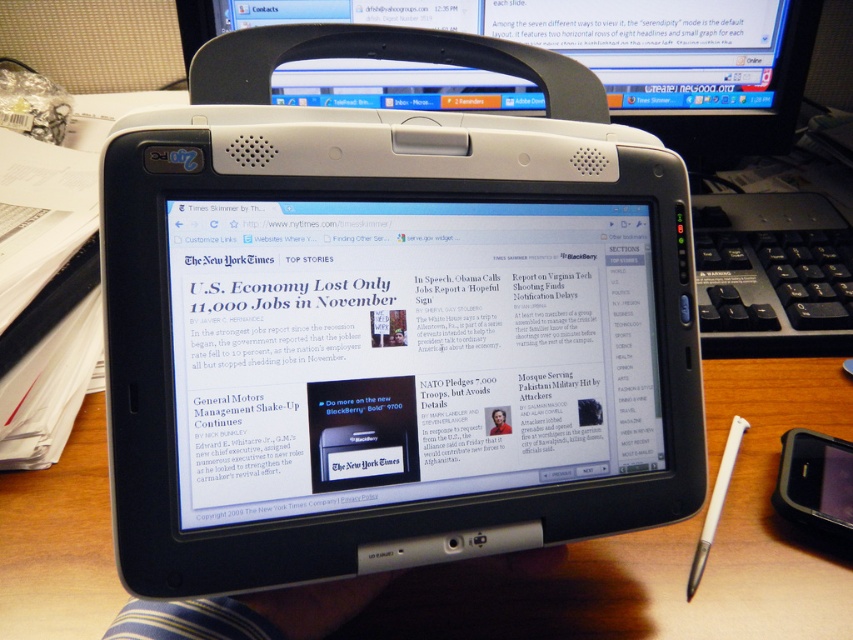
Looking at this image, you are organizing a desk and need to place both the black plastic computer monitor at upper center and the white plastic stylus at lower right. Which object requires more vertical space due to its height?

The black plastic computer monitor at upper center requires more vertical space because it is much taller than the white plastic stylus at lower right.

You are trying to place a new document on the wooden desk in the image. The point at coordinate (662, 547) is where you want to place it. According to the scene description, is this point on the wooden desk?

Yes, the point at coordinate (662, 547) corresponds to the wooden table at center, so placing the document there would be on the wooden desk.

You are organizing your desk and want to place a new item on the wooden table at center. However, there is a white plastic laptop at center in the way. Can you move the laptop to make space?

The wooden table at center is positioned under the white plastic laptop at center, so the laptop is likely resting on the table. You can move the white plastic laptop at center to create space on the wooden table at center.